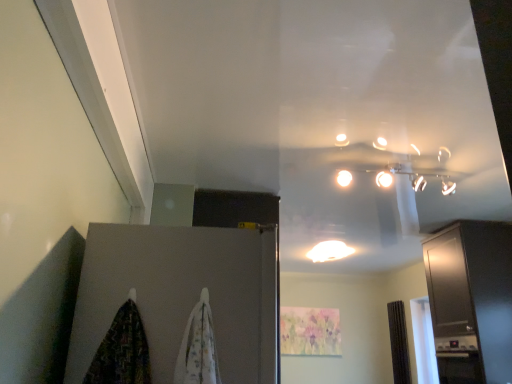
Question: Considering the relative positions of white glossy light fixture at center and satin black cabinet at right in the image provided, is white glossy light fixture at center to the left of satin black cabinet at right from the viewer's perspective?

Choices:
 (A) no
 (B) yes

Answer: (B)

Question: From the image's perspective, is white glossy light fixture at center on top of satin black cabinet at right?

Choices:
 (A) yes
 (B) no

Answer: (A)

Question: From a real-world perspective, does white glossy light fixture at center sit lower than satin black cabinet at right?

Choices:
 (A) yes
 (B) no

Answer: (B)

Question: From the image's perspective, is white glossy light fixture at center located beneath satin black cabinet at right?

Choices:
 (A) yes
 (B) no

Answer: (B)

Question: Would you consider white glossy light fixture at center to be distant from satin black cabinet at right?

Choices:
 (A) no
 (B) yes

Answer: (B)

Question: From a real-world perspective, relative to satin black cabinet at right, is matte gray door at lower left vertically above or below?

Choices:
 (A) above
 (B) below

Answer: (B)

Question: In terms of size, does matte gray door at lower left appear bigger or smaller than satin black cabinet at right?

Choices:
 (A) big
 (B) small

Answer: (B)

Question: Visually, is matte gray door at lower left positioned to the left or to the right of satin black cabinet at right?

Choices:
 (A) left
 (B) right

Answer: (A)

Question: Considering the positions of matte gray door at lower left and satin black cabinet at right in the image, is matte gray door at lower left taller or shorter than satin black cabinet at right?

Choices:
 (A) short
 (B) tall

Answer: (A)

Question: Is satin black cabinet at right taller or shorter than white fabric curtain at center, which ranks as the first curtain in left-to-right order?

Choices:
 (A) tall
 (B) short

Answer: (A)

Question: Do you think satin black cabinet at right is within white fabric curtain at center, the 1th curtain viewed from the top, or outside of it?

Choices:
 (A) outside
 (B) inside

Answer: (A)

Question: Considering the positions of satin black cabinet at right and white fabric curtain at center, marked as the 2th curtain in a right-to-left arrangement, in the image, is satin black cabinet at right bigger or smaller than white fabric curtain at center, marked as the 2th curtain in a right-to-left arrangement,?

Choices:
 (A) big
 (B) small

Answer: (A)

Question: From the image's perspective, is satin black cabinet at right above or below white fabric curtain at center, the 1th curtain viewed from the top?

Choices:
 (A) below
 (B) above

Answer: (A)

Question: In the image, is satin black cabinet at right positioned in front of or behind matte gray door at lower left?

Choices:
 (A) behind
 (B) front

Answer: (A)

Question: In terms of width, does satin black cabinet at right look wider or thinner when compared to matte gray door at lower left?

Choices:
 (A) thin
 (B) wide

Answer: (A)